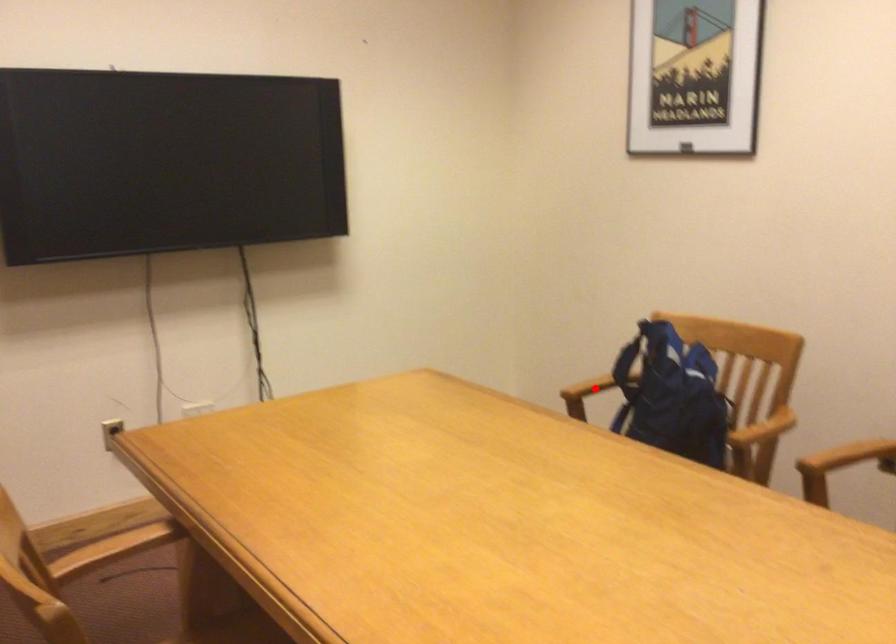
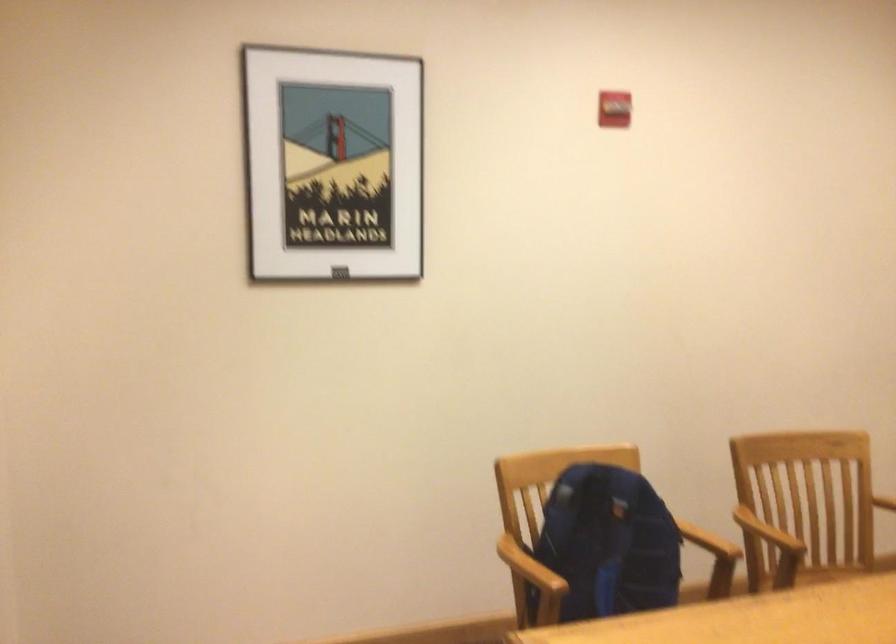
Question: I am providing you with two images of the same scene from different viewpoints. Given a red point in image1, look at the same physical point in image2. Is it:

Choices:
 (A) Closer to the viewpoint
 (B) Farther from the viewpoint

Answer: (A)